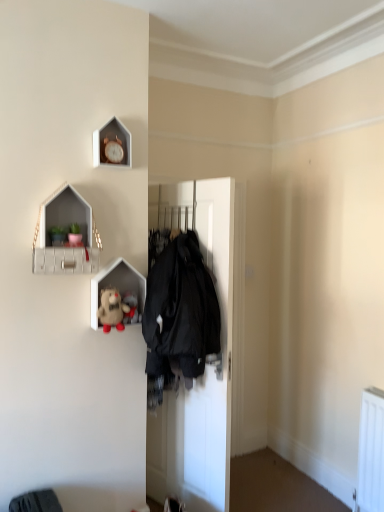
Question: Considering the relative sizes of matte white plush toy at center, positioned as the first shelf in bottom-to-top order, and matte white shelf at upper left, which is the 2th shelf in bottom-to-top order, in the image provided, is matte white plush toy at center, positioned as the first shelf in bottom-to-top order, taller than matte white shelf at upper left, which is the 2th shelf in bottom-to-top order,?

Choices:
 (A) no
 (B) yes

Answer: (A)

Question: From the image's perspective, does matte white plush toy at center, placed as the second shelf when sorted from top to bottom, appear lower than matte white shelf at upper left, which appears as the 1th shelf when viewed from the top?

Choices:
 (A) yes
 (B) no

Answer: (A)

Question: Does matte white plush toy at center, positioned as the first shelf in bottom-to-top order, come behind matte white shelf at upper left, which is the 2th shelf in bottom-to-top order?

Choices:
 (A) yes
 (B) no

Answer: (A)

Question: Could you tell me if matte white plush toy at center, placed as the second shelf when sorted from top to bottom, is facing matte white shelf at upper left, which appears as the 1th shelf when viewed from the top?

Choices:
 (A) no
 (B) yes

Answer: (A)

Question: Is matte white plush toy at center, positioned as the first shelf in bottom-to-top order, in front of matte white shelf at upper left, which is the 2th shelf in bottom-to-top order?

Choices:
 (A) yes
 (B) no

Answer: (B)

Question: Does matte white plush toy at center, positioned as the first shelf in bottom-to-top order, have a larger size compared to matte white shelf at upper left, which appears as the 1th shelf when viewed from the top?

Choices:
 (A) no
 (B) yes

Answer: (A)

Question: From the image's perspective, is wooden clock at upper center on top of fluffy fabric stuffed animal at center, which is the 2th toy from front to back?

Choices:
 (A) yes
 (B) no

Answer: (A)

Question: Is the depth of wooden clock at upper center less than that of fluffy fabric stuffed animal at center, which appears as the first toy when viewed from the back?

Choices:
 (A) no
 (B) yes

Answer: (B)

Question: Considering the relative sizes of wooden clock at upper center and fluffy fabric stuffed animal at center, which appears as the first toy when viewed from the back, in the image provided, is wooden clock at upper center smaller than fluffy fabric stuffed animal at center, which appears as the first toy when viewed from the back,?

Choices:
 (A) no
 (B) yes

Answer: (A)

Question: Is wooden clock at upper center shorter than fluffy fabric stuffed animal at center, which is the 2th toy from front to back?

Choices:
 (A) no
 (B) yes

Answer: (A)

Question: Is wooden clock at upper center outside fluffy fabric stuffed animal at center, which appears as the first toy when viewed from the back?

Choices:
 (A) yes
 (B) no

Answer: (A)

Question: Is wooden clock at upper center aimed at fluffy fabric stuffed animal at center, which is the 2th toy from front to back?

Choices:
 (A) no
 (B) yes

Answer: (A)

Question: Would you say fluffy beige teddy bear at upper left, the 2th toy from the back, is a long distance from matte white plush toy at center, positioned as the first shelf in bottom-to-top order?

Choices:
 (A) yes
 (B) no

Answer: (B)